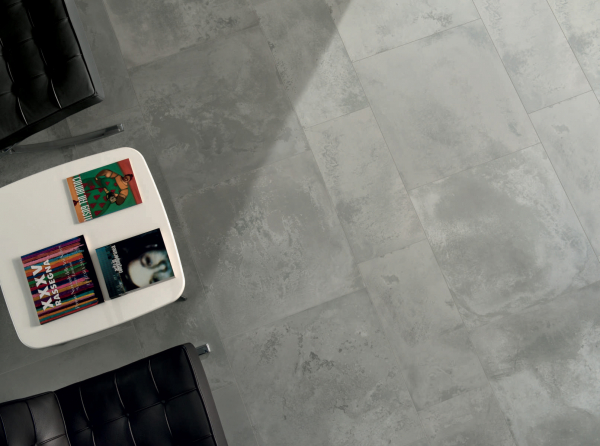
Find the location of `chairs`. chairs is located at coordinates pyautogui.click(x=129, y=396), pyautogui.click(x=33, y=107).